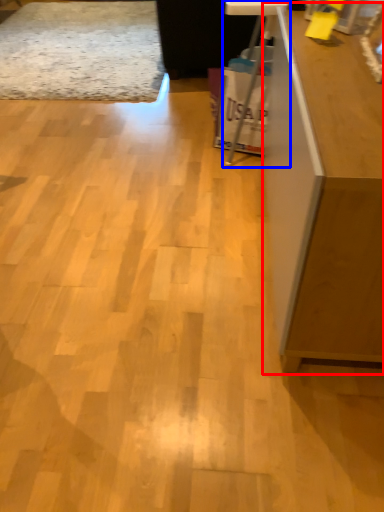
Question: Which of the following is the farthest to the observer, furniture (highlighted by a red box) or computer desk (highlighted by a blue box)?

Choices:
 (A) furniture
 (B) computer desk

Answer: (B)